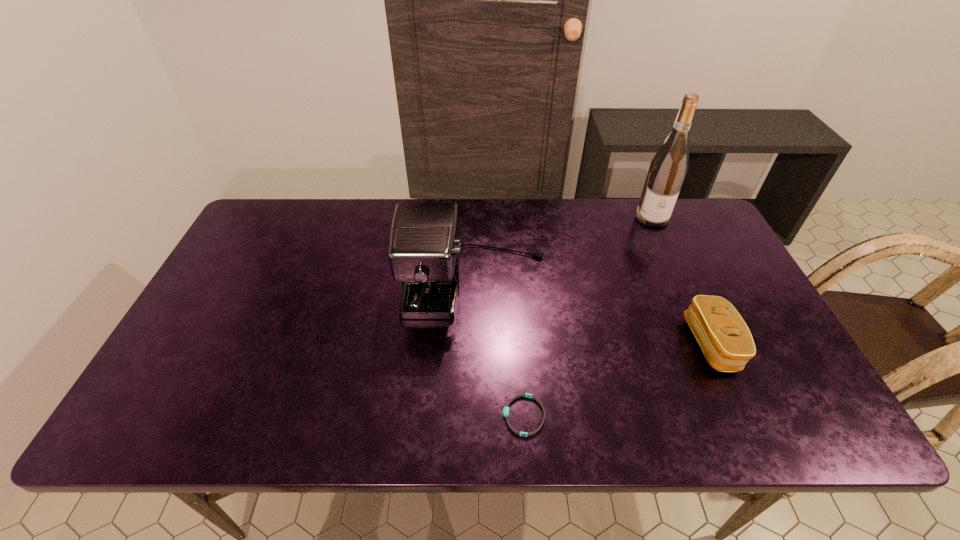
At what (x,y) coordinates should I click in order to perform the action: click on blank region between the clutch bag and the farthest object. Please return your answer as a coordinate pair (x, y). The width and height of the screenshot is (960, 540). Looking at the image, I should click on (682, 280).

At what (x,y) coordinates should I click in order to perform the action: click on vacant space that is in between the farthest object and the second shortest object. Please return your answer as a coordinate pair (x, y). Image resolution: width=960 pixels, height=540 pixels. Looking at the image, I should click on (682, 280).

Locate an element on the screen. Image resolution: width=960 pixels, height=540 pixels. free spot between the coffee maker and the nearest object is located at coordinates (499, 351).

I want to click on vacant region between the nearest object and the second tallest object, so click(x=499, y=351).

Select which object appears as the second closest to the coffee maker. Please provide its 2D coordinates. Your answer should be formatted as a tuple, i.e. [(x, y)], where the tuple contains the x and y coordinates of a point satisfying the conditions above.

[(726, 341)]

Image resolution: width=960 pixels, height=540 pixels. Find the location of `object that stands as the second closest to the tallest object`. object that stands as the second closest to the tallest object is located at coordinates (726, 341).